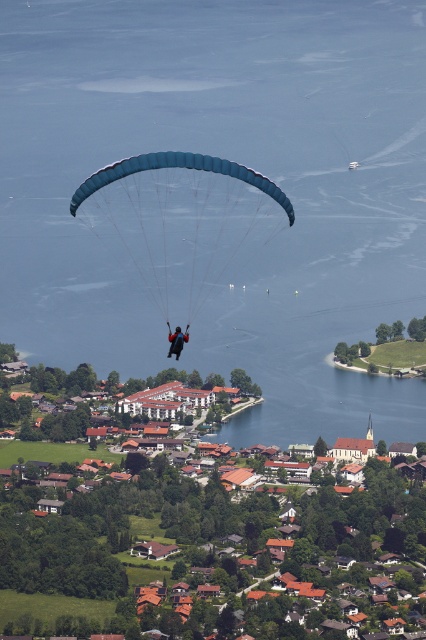
Question: Does blue water at center appear under brown tiled roofs at center?

Choices:
 (A) yes
 (B) no

Answer: (B)

Question: Estimate the real-world distances between objects in this image. Which object is farther from the dark blue fabric parachute at center?

Choices:
 (A) brown tiled roofs at center
 (B) blue water at center
 (C) blue fabric parachute at center

Answer: (A)

Question: Which point appears farthest from the camera in this image?

Choices:
 (A) (187, 490)
 (B) (108, 204)
 (C) (180, 326)
 (D) (403, 20)

Answer: (D)

Question: Estimate the real-world distances between objects in this image. Which object is closer to the brown tiled roofs at center?

Choices:
 (A) blue fabric parachute at center
 (B) dark blue fabric parachute at center

Answer: (B)

Question: Does brown tiled roofs at center appear over dark blue fabric parachute at center?

Choices:
 (A) yes
 (B) no

Answer: (B)

Question: Where is blue water at center located in relation to brown tiled roofs at center in the image?

Choices:
 (A) left
 (B) right

Answer: (B)